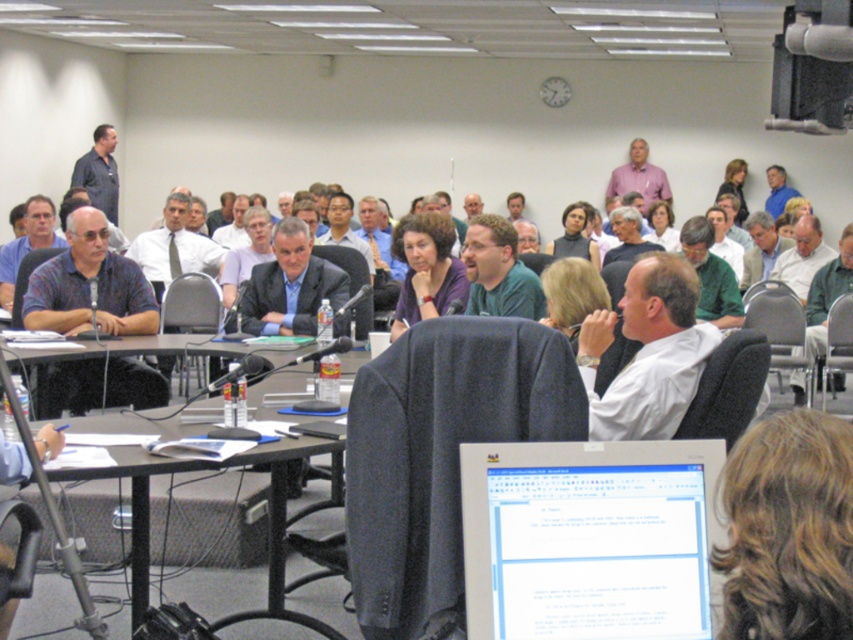
You are sitting at the back of the conference room and want to see the computer monitor in the foreground. Which attendee, the dark blue shirt at left or the matte blue shirt at center, is blocking your view more?

The dark blue shirt at left is below the matte blue shirt at center, so the matte blue shirt at center is higher and thus blocking more of your view to the computer monitor in the foreground.